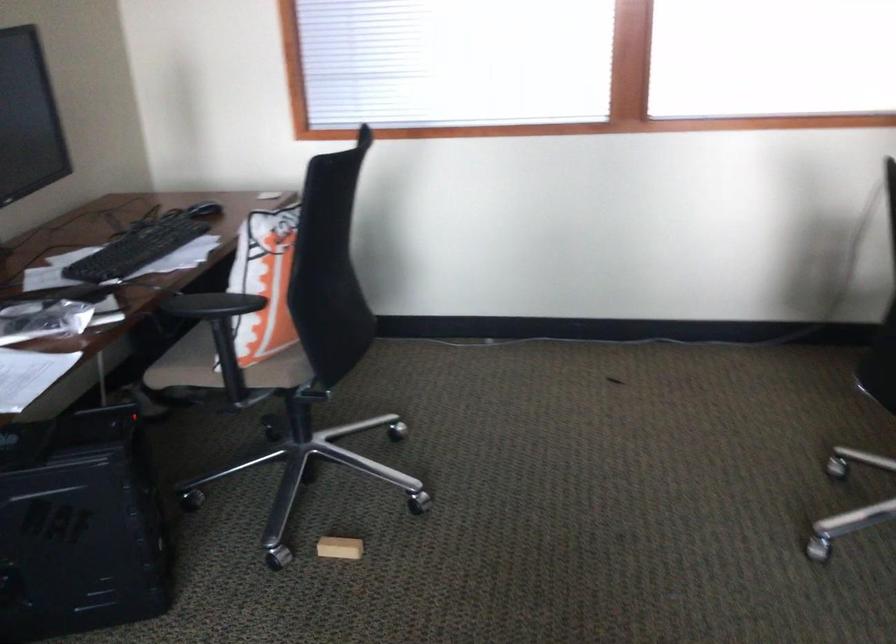
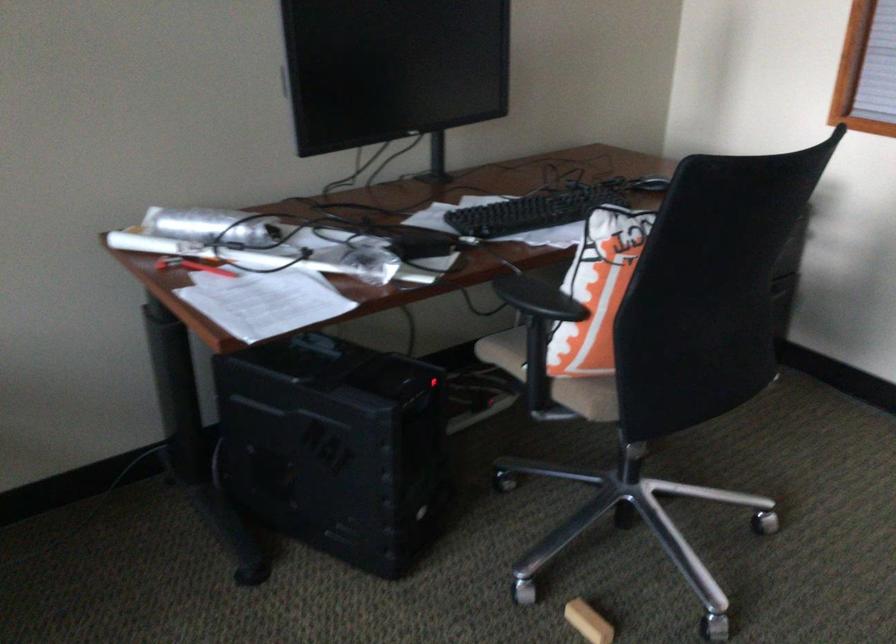
Locate, in the second image, the point that corresponds to point (246, 366) in the first image.

(552, 377)